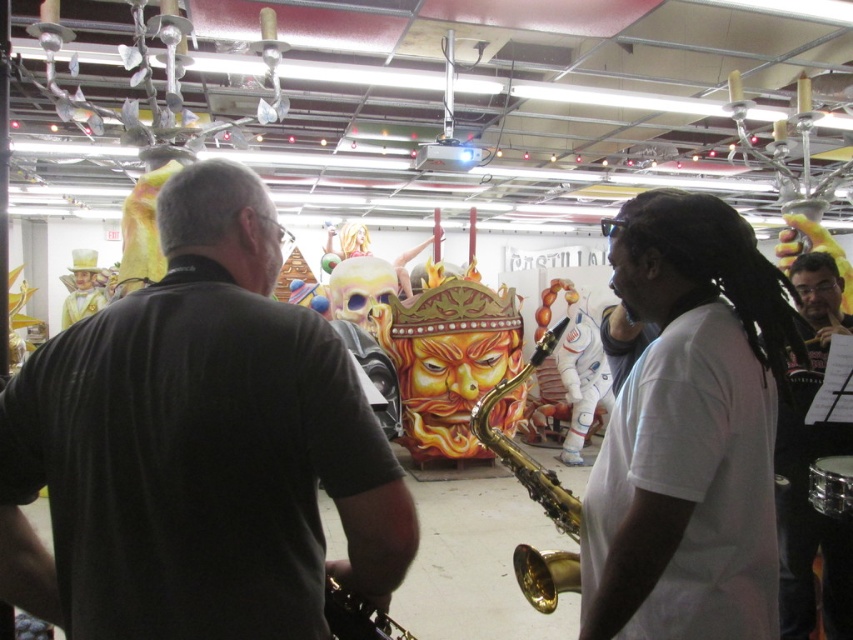
Question: Which point appears farthest from the camera in this image?

Choices:
 (A) (186, 308)
 (B) (474, 424)
 (C) (844, 474)

Answer: (C)

Question: Does matte black saxophone at center appear under shiny silver drum at lower right?

Choices:
 (A) no
 (B) yes

Answer: (A)

Question: Can you confirm if matte black saxophone at center is thinner than gold brass saxophone at center?

Choices:
 (A) yes
 (B) no

Answer: (B)

Question: Which point is farther from the camera taking this photo?

Choices:
 (A) (824, 502)
 (B) (376, 632)

Answer: (A)

Question: Does white matte t-shirt at center have a smaller size compared to shiny silver drum at lower right?

Choices:
 (A) no
 (B) yes

Answer: (A)

Question: Which point appears closest to the camera in this image?

Choices:
 (A) (839, 488)
 (B) (207, 214)

Answer: (B)